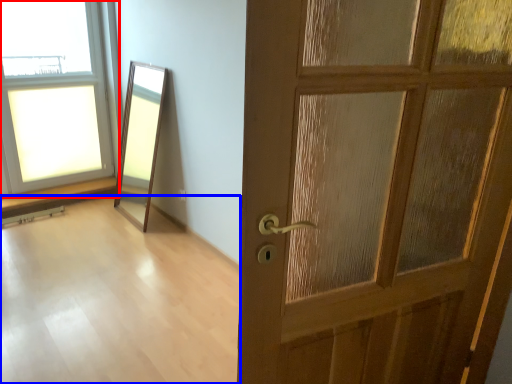
Question: Which object appears farthest to the camera in this image, window (highlighted by a red box) or corridor (highlighted by a blue box)?

Choices:
 (A) window
 (B) corridor

Answer: (A)